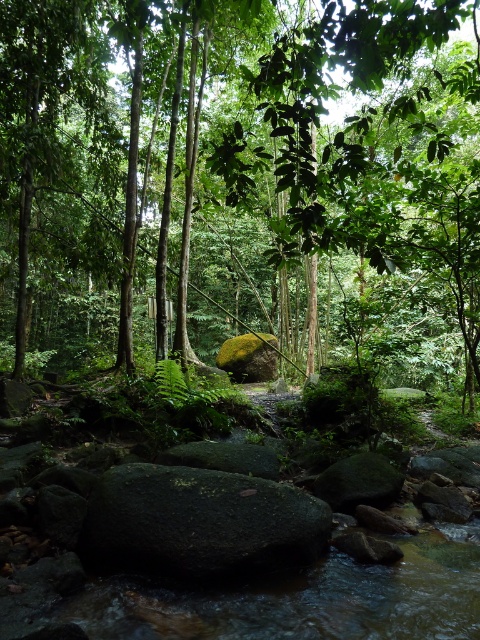
Question: Can you confirm if green leafy tree at center is positioned above green mossy rock at center?

Choices:
 (A) yes
 (B) no

Answer: (A)

Question: Does green leafy tree at center appear on the right side of green mossy rock at center?

Choices:
 (A) no
 (B) yes

Answer: (A)

Question: Which of the following is the closest to the observer?

Choices:
 (A) (445, 138)
 (B) (131, 524)

Answer: (B)

Question: Can you confirm if green leafy tree at center is smaller than green mossy rock at center?

Choices:
 (A) yes
 (B) no

Answer: (B)

Question: Which point is farther to the camera?

Choices:
 (A) green mossy rock at center
 (B) green leafy tree at center

Answer: (B)